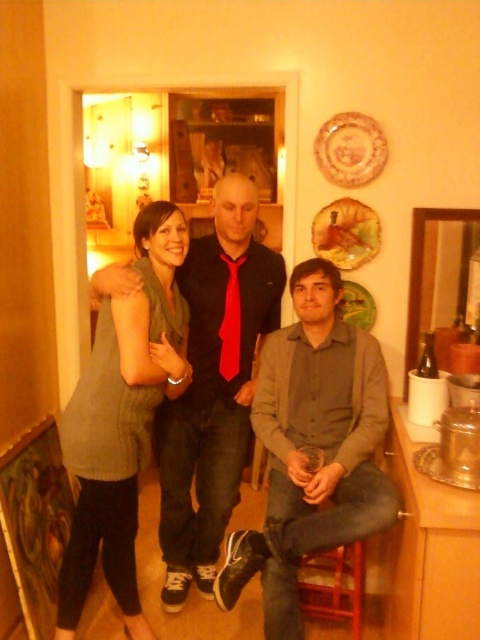
Is matte gray shirt at center closer to camera compared to red satin tie at center?

Yes.

Does matte gray shirt at center have a lesser height compared to red satin tie at center?

In fact, matte gray shirt at center may be taller than red satin tie at center.

Which is in front, point (284, 330) or point (220, 371)?

Positioned in front is point (220, 371).

Identify the location of matte gray shirt at center. (312, 449).

Can you confirm if matte black shirt at center is bigger than red satin tie at center?

Correct, matte black shirt at center is larger in size than red satin tie at center.

Is matte black shirt at center positioned before red satin tie at center?

Yes, it is in front of red satin tie at center.

Locate an element on the screen. The height and width of the screenshot is (640, 480). matte black shirt at center is located at coordinates (214, 392).

In the scene shown: Does green knit sweater at left appear on the left side of red satin tie at center?

Correct, you'll find green knit sweater at left to the left of red satin tie at center.

Is point (147, 380) behind point (240, 352)?

No, it is not.

Measure the distance between green knit sweater at left and camera.

green knit sweater at left and camera are 6.21 feet apart.

Identify the location of green knit sweater at left. (122, 419).